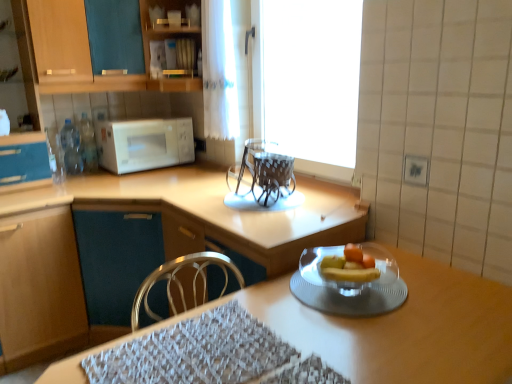
The width and height of the screenshot is (512, 384). I want to click on vacant space in between woven fabric place mat at lower center and transparent glass plate at lower right, so click(301, 316).